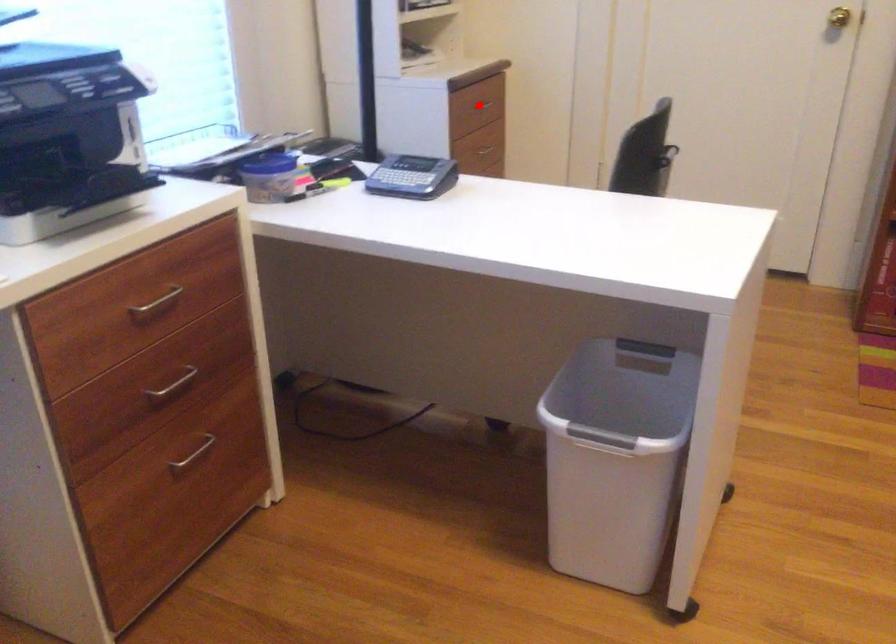
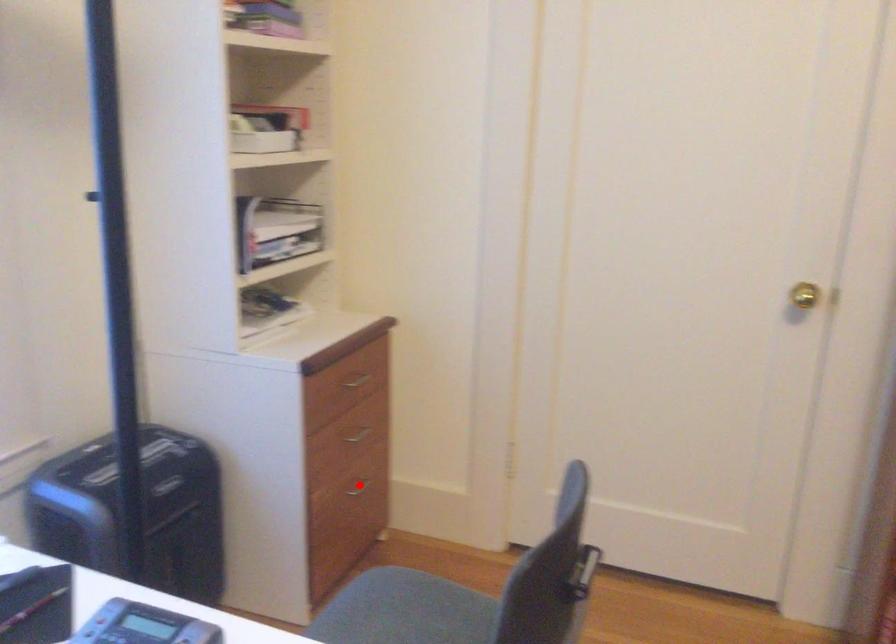
I am providing you with two images of the same scene from different viewpoints. A red point is marked on the first image and another point is marked on the second image. Do the highlighted points in image1 and image2 indicate the same real-world spot?

No